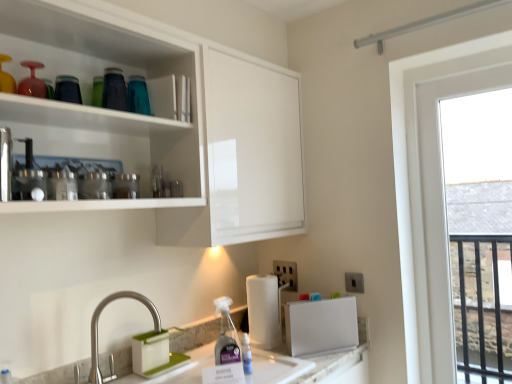
How much space does white plastic electric outlet at lower center, placed as the second electric outlet when sorted from front to back, occupy horizontally?

The width of white plastic electric outlet at lower center, placed as the second electric outlet when sorted from front to back, is 1.05 inches.

Where is `white plastic electric outlet at lower center, which is the second electric outlet in right-to-left order`? This screenshot has height=384, width=512. white plastic electric outlet at lower center, which is the second electric outlet in right-to-left order is located at coordinates (286, 273).

In order to face polished stainless steel faucet at lower left, should I rotate leftwards or rightwards?

Rotate your view left by about 17.862°.

Find the location of a particular element. The image size is (512, 384). white plastic magnetic board at lower center, the second appliance viewed from the front is located at coordinates (321, 326).

Locate an element on the screen. This screenshot has height=384, width=512. white plastic electric outlet at lower right, placed as the first electric outlet when sorted from right to left is located at coordinates (354, 282).

Describe the element at coordinates (263, 311) in the screenshot. I see `white matte paper towel at lower center` at that location.

Find the location of `white plastic electric outlet at lower center, which ranks as the 1th electric outlet in back-to-front order`. white plastic electric outlet at lower center, which ranks as the 1th electric outlet in back-to-front order is located at coordinates (286, 273).

From the picture: From a real-world perspective, who is located lower, white plastic electric outlet at lower right, which is counted as the second electric outlet, starting from the back, or transparent glass window at right?

white plastic electric outlet at lower right, which is counted as the second electric outlet, starting from the back.

Looking at this image, considering the sizes of objects white plastic electric outlet at lower right, placed as the first electric outlet when sorted from right to left, and transparent glass window at right in the image provided, who is wider, white plastic electric outlet at lower right, placed as the first electric outlet when sorted from right to left, or transparent glass window at right?

transparent glass window at right is wider.

From the image's perspective, which one is positioned lower, white plastic electric outlet at lower right, which ranks as the 2th electric outlet in left-to-right order, or transparent glass window at right?

white plastic electric outlet at lower right, which ranks as the 2th electric outlet in left-to-right order.

Considering the sizes of white plastic electric outlet at lower right, which is counted as the second electric outlet, starting from the back, and transparent glass window at right in the image, is white plastic electric outlet at lower right, which is counted as the second electric outlet, starting from the back, taller or shorter than transparent glass window at right?

In the image, white plastic electric outlet at lower right, which is counted as the second electric outlet, starting from the back, appears to be shorter than transparent glass window at right.

Does white plastic electric outlet at lower center, marked as the first electric outlet in a left-to-right arrangement, have a larger size compared to white plastic magnetic board at lower center, which is counted as the 2th appliance, starting from the top?

Actually, white plastic electric outlet at lower center, marked as the first electric outlet in a left-to-right arrangement, might be smaller than white plastic magnetic board at lower center, which is counted as the 2th appliance, starting from the top.

From the image's perspective, which object appears higher, white plastic electric outlet at lower center, marked as the first electric outlet in a left-to-right arrangement, or white plastic magnetic board at lower center, which is the first appliance from bottom to top?

white plastic electric outlet at lower center, marked as the first electric outlet in a left-to-right arrangement, from the image's perspective.

Is point (288, 269) positioned in front of point (354, 298)?

No, it is behind (354, 298).

Is white plastic electric outlet at lower center, placed as the second electric outlet when sorted from front to back, spatially inside white plastic magnetic board at lower center, the 1th appliance from the back, or outside of it?

white plastic electric outlet at lower center, placed as the second electric outlet when sorted from front to back, is located beyond the bounds of white plastic magnetic board at lower center, the 1th appliance from the back.

Is transparent glass window at right placed right next to white plastic electric outlet at lower right, which ranks as the 2th electric outlet in left-to-right order?

No, transparent glass window at right is not in contact with white plastic electric outlet at lower right, which ranks as the 2th electric outlet in left-to-right order.

Considering the positions of objects transparent glass window at right and white plastic electric outlet at lower right, which is counted as the second electric outlet, starting from the back, in the image provided, who is behind, transparent glass window at right or white plastic electric outlet at lower right, which is counted as the second electric outlet, starting from the back,?

white plastic electric outlet at lower right, which is counted as the second electric outlet, starting from the back.

What's the angular difference between transparent glass window at right and white plastic electric outlet at lower right, the first electric outlet viewed from the front,'s facing directions?

They differ by 1.14 degrees in their facing directions.

Is transparent glass window at right inside or outside of white plastic electric outlet at lower right, which is counted as the second electric outlet, starting from the back?

transparent glass window at right is located beyond the bounds of white plastic electric outlet at lower right, which is counted as the second electric outlet, starting from the back.

Between white plastic magnetic board at lower center, which is counted as the first appliance, starting from the right, and transparent glass window at right, which one appears on the right side from the viewer's perspective?

From the viewer's perspective, transparent glass window at right appears more on the right side.

Who is taller, white plastic magnetic board at lower center, which is the first appliance from bottom to top, or transparent glass window at right?

transparent glass window at right is taller.

From a real-world perspective, between white plastic magnetic board at lower center, the 1th appliance from the back, and transparent glass window at right, who is vertically lower?

white plastic magnetic board at lower center, the 1th appliance from the back, is physically lower.

In the scene shown: Can you confirm if white plastic magnetic board at lower center, the 1th appliance from the back, is thinner than transparent glass window at right?

No, white plastic magnetic board at lower center, the 1th appliance from the back, is not thinner than transparent glass window at right.

In the scene shown: From a real-world perspective, is white matte paper towel at lower center physically located above or below white plastic electric outlet at lower center, which ranks as the 1th electric outlet in back-to-front order?

In terms of real-world spatial position, white matte paper towel at lower center is below white plastic electric outlet at lower center, which ranks as the 1th electric outlet in back-to-front order.

Based on the photo, could you tell me if white matte paper towel at lower center is turned towards white plastic electric outlet at lower center, which is the second electric outlet in right-to-left order?

No, white matte paper towel at lower center is not facing towards white plastic electric outlet at lower center, which is the second electric outlet in right-to-left order.

Considering the relative sizes of white matte paper towel at lower center and white plastic electric outlet at lower center, placed as the second electric outlet when sorted from front to back, in the image provided, is white matte paper towel at lower center smaller than white plastic electric outlet at lower center, placed as the second electric outlet when sorted from front to back,?

Actually, white matte paper towel at lower center might be larger than white plastic electric outlet at lower center, placed as the second electric outlet when sorted from front to back.

Is point (265, 283) closer to viewer compared to point (292, 286)?

Yes, point (265, 283) is in front of point (292, 286).

From a real-world perspective, is white plastic electric outlet at lower right, placed as the first electric outlet when sorted from right to left, positioned above or below polished stainless steel faucet at lower left?

In terms of real-world spatial position, white plastic electric outlet at lower right, placed as the first electric outlet when sorted from right to left, is above polished stainless steel faucet at lower left.

Who is smaller, white plastic electric outlet at lower right, placed as the first electric outlet when sorted from right to left, or polished stainless steel faucet at lower left?

white plastic electric outlet at lower right, placed as the first electric outlet when sorted from right to left.

Consider the image. Can you tell me how much white plastic electric outlet at lower right, placed as the first electric outlet when sorted from right to left, and polished stainless steel faucet at lower left differ in facing direction?

white plastic electric outlet at lower right, placed as the first electric outlet when sorted from right to left, and polished stainless steel faucet at lower left are facing 88.6 degrees away from each other.

From a real-world perspective, count 2nd electric outlets upward from the polished stainless steel faucet at lower left and point to it. Please provide its 2D coordinates.

[(354, 282)]

Based on their sizes in the image, would you say white plastic magnetic board at lower center, which is counted as the first appliance, starting from the right, is bigger or smaller than metallic silver blender at upper left, the 1th appliance in the left-to-right sequence?

In the image, white plastic magnetic board at lower center, which is counted as the first appliance, starting from the right, appears to be larger than metallic silver blender at upper left, the 1th appliance in the left-to-right sequence.

Between white plastic magnetic board at lower center, the 1th appliance from the back, and metallic silver blender at upper left, the 1th appliance in the left-to-right sequence, which one has more height?

Standing taller between the two is white plastic magnetic board at lower center, the 1th appliance from the back.

Which of these two, white plastic magnetic board at lower center, the second appliance viewed from the front, or metallic silver blender at upper left, which ranks as the first appliance in top-to-bottom order, is thinner?

metallic silver blender at upper left, which ranks as the first appliance in top-to-bottom order, is thinner.

Is point (330, 316) in front of point (46, 192)?

That is False.

Locate an element on the screen. This screenshot has height=384, width=512. window in front of the white plastic electric outlet at lower right, which ranks as the 2th electric outlet in left-to-right order is located at coordinates (480, 230).

Find the location of a particular element. Image resolution: width=512 pixels, height=384 pixels. appliance below the white plastic electric outlet at lower center, placed as the second electric outlet when sorted from front to back (from a real-world perspective) is located at coordinates (321, 326).

From the image, which object appears to be farther from white plastic electric outlet at lower right, placed as the first electric outlet when sorted from right to left, white plastic electric outlet at lower center, which is the second electric outlet in right-to-left order, or transparent glass window at right?

Among the two, transparent glass window at right is located further to white plastic electric outlet at lower right, placed as the first electric outlet when sorted from right to left.

Consider the image. Based on their spatial positions, is white matte paper towel at lower center or white plastic magnetic board at lower center, the second appliance viewed from the front, further from metallic silver blender at upper left, which is counted as the second appliance, starting from the back?

Based on the image, white plastic magnetic board at lower center, the second appliance viewed from the front, appears to be further to metallic silver blender at upper left, which is counted as the second appliance, starting from the back.

From the image, which object appears to be nearer to white plastic magnetic board at lower center, the second appliance viewed from the front, white plastic electric outlet at lower right, which is counted as the second electric outlet, starting from the back, or transparent glass window at right?

white plastic electric outlet at lower right, which is counted as the second electric outlet, starting from the back, lies closer to white plastic magnetic board at lower center, the second appliance viewed from the front, than the other object.

Looking at the image, which one is located closer to white plastic electric outlet at lower center, which is the second electric outlet in right-to-left order, metallic silver blender at upper left, which is counted as the second appliance, starting from the bottom, or polished stainless steel faucet at lower left?

Among the two, polished stainless steel faucet at lower left is located nearer to white plastic electric outlet at lower center, which is the second electric outlet in right-to-left order.

Considering their positions, is white plastic magnetic board at lower center, the second appliance from the left, positioned further to transparent glass window at right than white matte paper towel at lower center?

white matte paper towel at lower center.

Consider the image. Which object lies further to the anchor point white plastic electric outlet at lower right, which is counted as the second electric outlet, starting from the back, metallic silver blender at upper left, acting as the 1th appliance starting from the front, or white plastic magnetic board at lower center, the 1th appliance from the back?

Among the two, metallic silver blender at upper left, acting as the 1th appliance starting from the front, is located further to white plastic electric outlet at lower right, which is counted as the second electric outlet, starting from the back.

Looking at the image, which one is located closer to transparent glass window at right, metallic silver blender at upper left, which is counted as the second appliance, starting from the back, or white plastic electric outlet at lower right, the first electric outlet viewed from the front?

white plastic electric outlet at lower right, the first electric outlet viewed from the front, is positioned closer to the anchor transparent glass window at right.

Considering their positions, is metallic silver blender at upper left, which ranks as the first appliance in top-to-bottom order, positioned further to white plastic magnetic board at lower center, the second appliance from the left, than white plastic electric outlet at lower right, which ranks as the 2th electric outlet in left-to-right order?

metallic silver blender at upper left, which ranks as the first appliance in top-to-bottom order.

What are the coordinates of `paper towel located between metallic silver blender at upper left, which is counted as the second appliance, starting from the back, and white plastic electric outlet at lower center, which ranks as the 1th electric outlet in back-to-front order, in the depth direction` in the screenshot? It's located at (263, 311).

You are a GUI agent. You are given a task and a screenshot of the screen. Output one action in this format:
    pyautogui.click(x=<x>, y=<y>)
    Task: Click on the electric outlet situated between metallic silver blender at upper left, which ranks as the first appliance in top-to-bottom order, and white plastic electric outlet at lower right, which is counted as the second electric outlet, starting from the back, from left to right
    The width and height of the screenshot is (512, 384).
    Given the screenshot: What is the action you would take?
    pyautogui.click(x=286, y=273)

Locate an element on the screen. The width and height of the screenshot is (512, 384). appliance located between white matte paper towel at lower center and transparent glass window at right in the left-right direction is located at coordinates (321, 326).

The image size is (512, 384). What are the coordinates of `appliance positioned between polished stainless steel faucet at lower left and white plastic electric outlet at lower center, marked as the first electric outlet in a left-to-right arrangement, from near to far` in the screenshot? It's located at (321, 326).